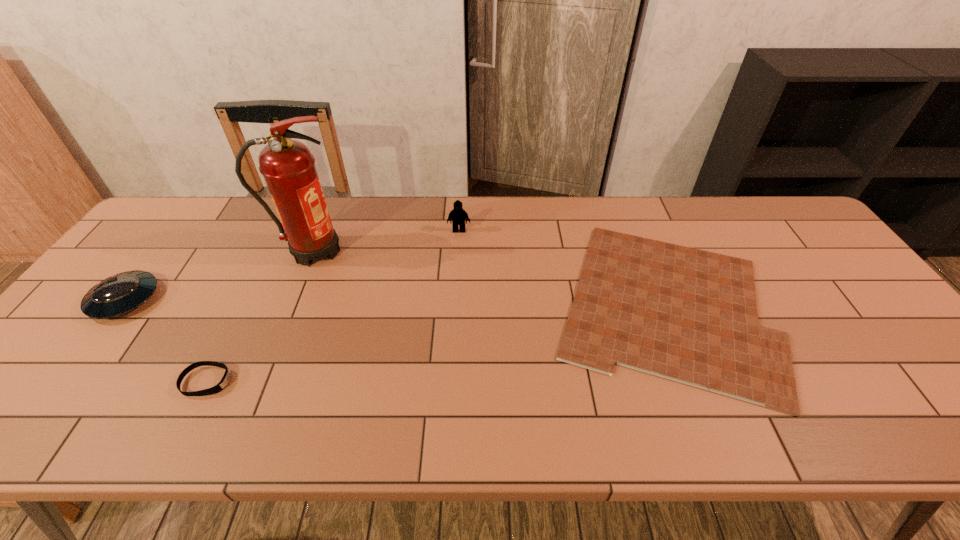
Locate an element on the screen. The height and width of the screenshot is (540, 960). fire extinguisher is located at coordinates (288, 167).

You are a GUI agent. You are given a task and a screenshot of the screen. Output one action in this format:
    pyautogui.click(x=<x>, y=<y>)
    Task: Click on the Lego
    The height and width of the screenshot is (540, 960).
    Given the screenshot: What is the action you would take?
    pyautogui.click(x=457, y=216)

At what (x,y) coordinates should I click in order to perform the action: click on the fourth shortest object. Please return your answer as a coordinate pair (x, y). The width and height of the screenshot is (960, 540). Looking at the image, I should click on (457, 216).

You are a GUI agent. You are given a task and a screenshot of the screen. Output one action in this format:
    pyautogui.click(x=<x>, y=<y>)
    Task: Click on the leftmost object
    
    Given the screenshot: What is the action you would take?
    pyautogui.click(x=119, y=294)

At what (x,y) coordinates should I click in order to perform the action: click on saucer. Please return your answer as a coordinate pair (x, y). Looking at the image, I should click on (119, 294).

Where is `wristband`? Image resolution: width=960 pixels, height=540 pixels. wristband is located at coordinates (x=221, y=385).

The width and height of the screenshot is (960, 540). What are the coordinates of `the shortest object` in the screenshot? It's located at (688, 315).

Identify the location of gameboard. (688, 315).

In order to click on free spot located on the front-facing side of the tallest object in this screenshot , I will do `click(390, 251)`.

Find the location of a particular element. The height and width of the screenshot is (540, 960). free space located 0.300m on the face of the fourth object from left to right is located at coordinates (455, 307).